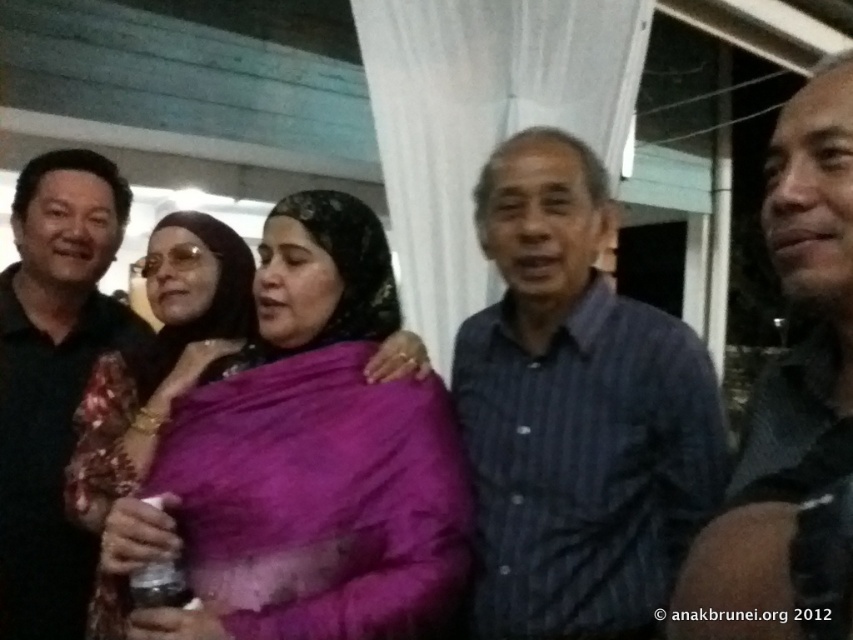
Is blue striped shirt at center behind purple silk saree at center?

That is True.

Is blue striped shirt at center bigger than purple silk saree at center?

Yes, blue striped shirt at center is bigger than purple silk saree at center.

Where is `blue striped shirt at center`? The image size is (853, 640). blue striped shirt at center is located at coordinates (575, 412).

How far apart are blue striped shirt at center and smooth skin face at center?

blue striped shirt at center is 15.91 inches away from smooth skin face at center.

Does blue striped shirt at center lie in front of smooth skin face at center?

No, blue striped shirt at center is behind smooth skin face at center.

The image size is (853, 640). Find the location of `blue striped shirt at center`. blue striped shirt at center is located at coordinates (575, 412).

The image size is (853, 640). What are the coordinates of `blue striped shirt at center` in the screenshot? It's located at (575, 412).

In the scene shown: Who is lower down, purple silk saree at center or smooth skin face at center?

purple silk saree at center

Is point (345, 390) behind point (840, 275)?

That is True.

Image resolution: width=853 pixels, height=640 pixels. Find the location of `purple silk saree at center`. purple silk saree at center is located at coordinates (317, 456).